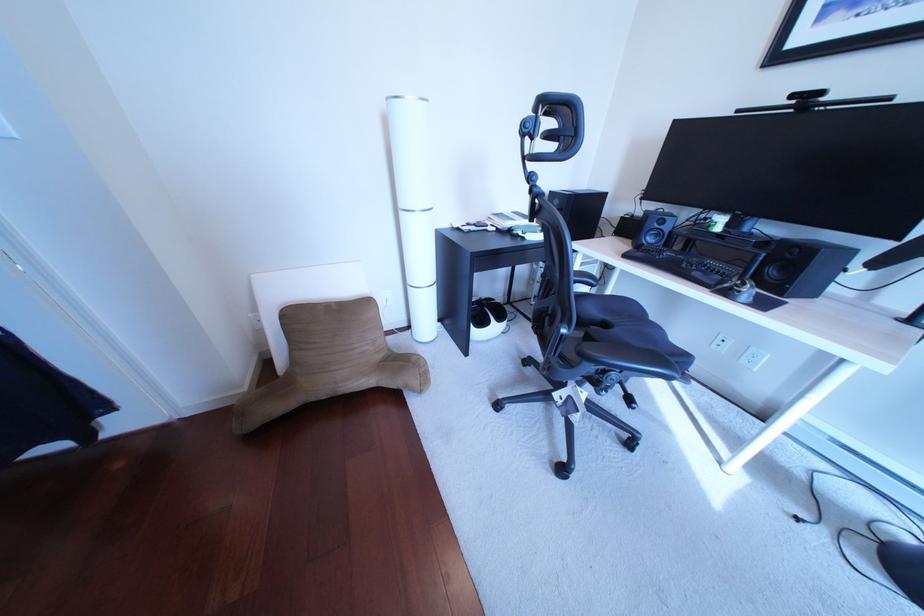
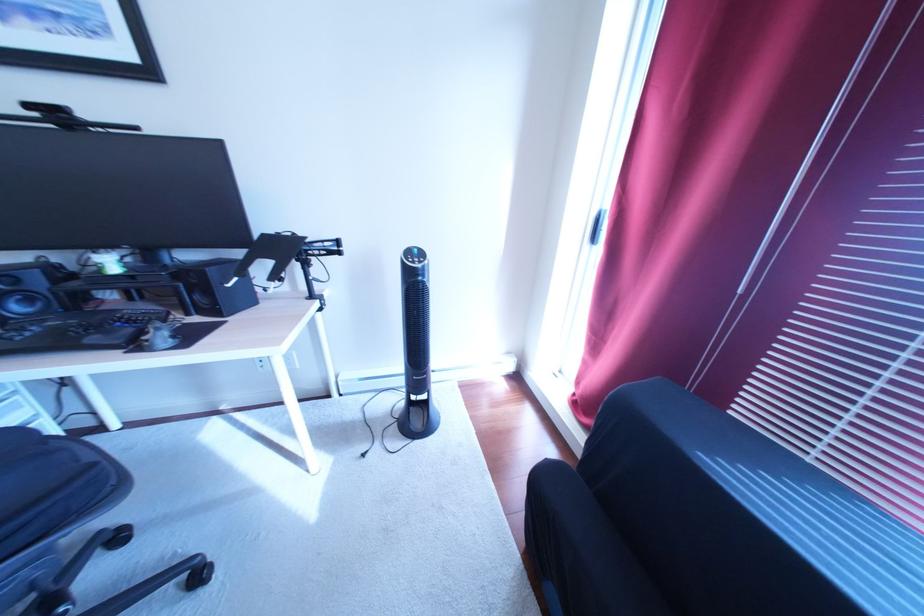
How did the camera likely rotate?

The camera rotated toward right-down.